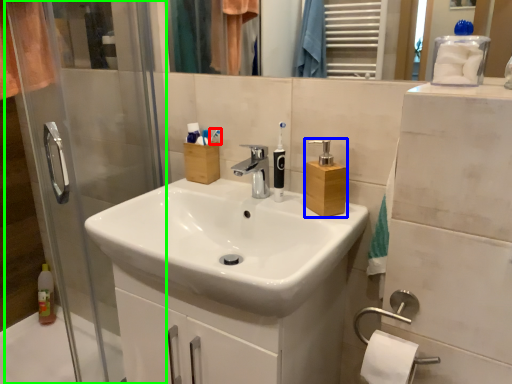
Question: Which object is the closest to the toothbrush (highlighted by a red box)? Choose among these: soap dispenser (highlighted by a blue box) or screen door (highlighted by a green box).

Choices:
 (A) soap dispenser
 (B) screen door

Answer: (A)